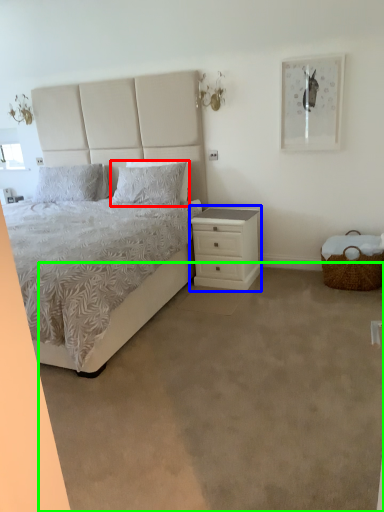
Question: Which object is positioned farthest from pillow (highlighted by a red box)? Select from nightstand (highlighted by a blue box) and plain (highlighted by a green box).

Choices:
 (A) nightstand
 (B) plain

Answer: (B)